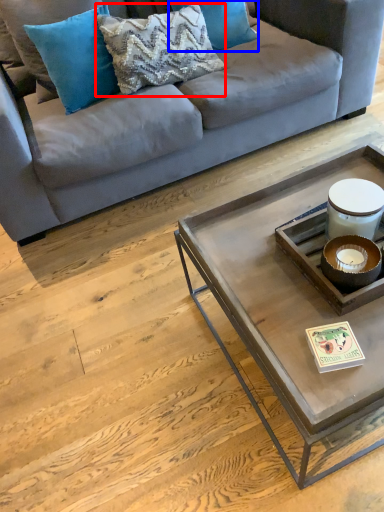
Question: Among these objects, which one is farthest to the camera, pillow (highlighted by a red box) or pillow (highlighted by a blue box)?

Choices:
 (A) pillow
 (B) pillow

Answer: (B)